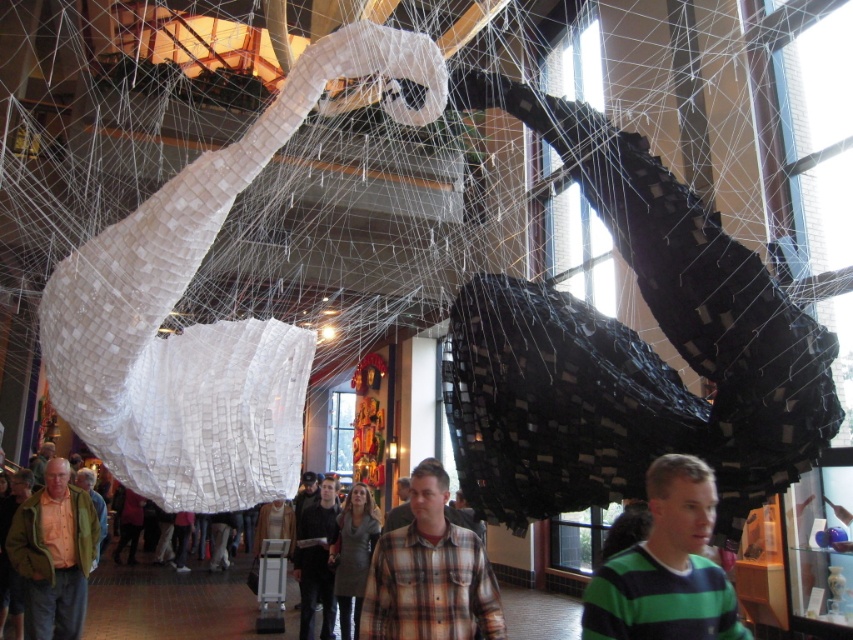
Question: Which object appears farthest from the camera in this image?

Choices:
 (A) green textured jacket at center
 (B) plaid shirt at center
 (C) green striped sweater at center

Answer: (A)

Question: Does green striped sweater at center appear on the left side of green textured jacket at center?

Choices:
 (A) yes
 (B) no

Answer: (B)

Question: Is plaid shirt at center further to the viewer compared to light brown leather jacket at lower left?

Choices:
 (A) yes
 (B) no

Answer: (B)

Question: Does plaid shirt at center appear under light brown leather jacket at lower left?

Choices:
 (A) no
 (B) yes

Answer: (A)

Question: Which of the following is the farthest from the observer?

Choices:
 (A) click(x=57, y=490)
 (B) click(x=387, y=609)
 (C) click(x=84, y=483)
 (D) click(x=717, y=589)

Answer: (C)

Question: Among these objects, which one is farthest from the camera?

Choices:
 (A) dark gray fabric jacket at center
 (B) plaid shirt at center
 (C) green striped sweater at center
 (D) light brown leather jacket at lower left

Answer: (A)